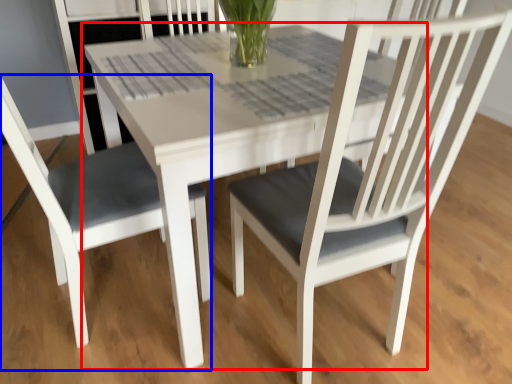
Question: Which object appears closest to the camera in this image, round table (highlighted by a red box) or chair (highlighted by a blue box)?

Choices:
 (A) round table
 (B) chair

Answer: (B)